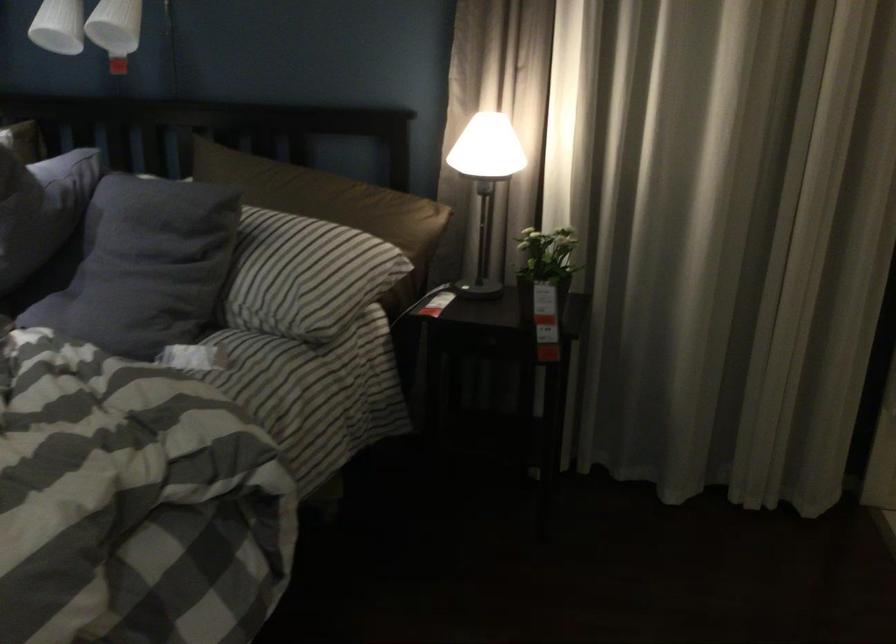
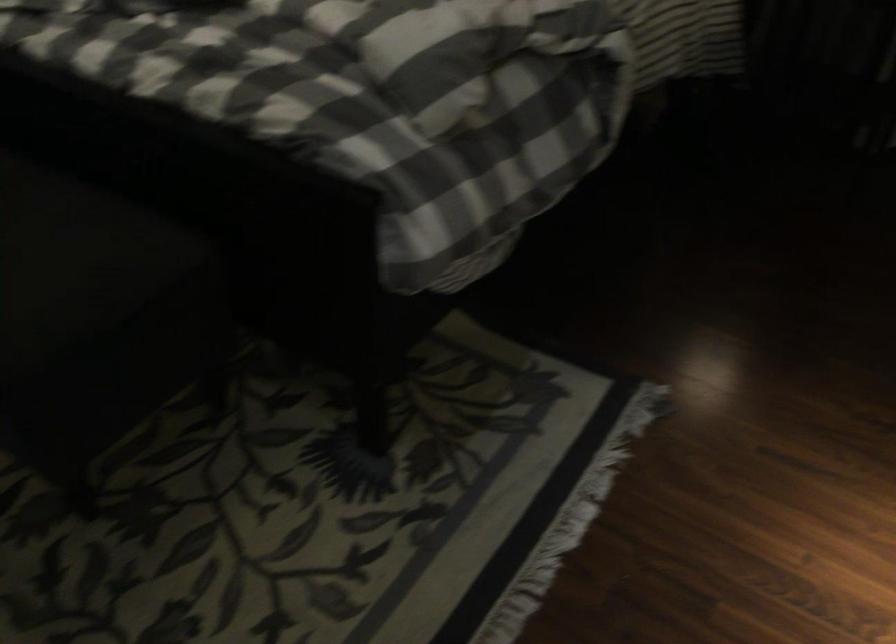
First-person continuous shooting, in which direction is the camera rotating?

The camera rotated toward left-down.